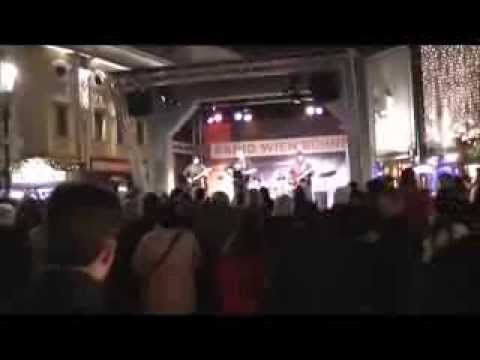
Where is `screen`? The image size is (480, 360). screen is located at coordinates (276, 152).